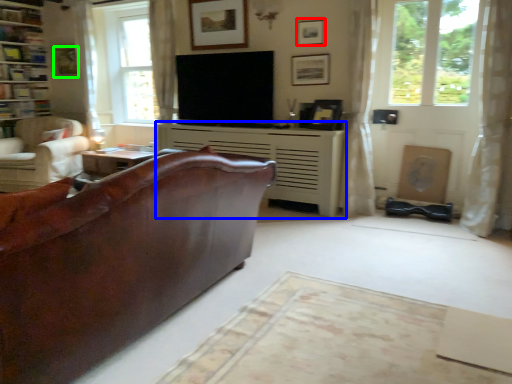
Question: Considering the real-world distances, which object is farthest from picture frame (highlighted by a red box)? fireplace (highlighted by a blue box) or picture frame (highlighted by a green box)?

Choices:
 (A) fireplace
 (B) picture frame

Answer: (B)